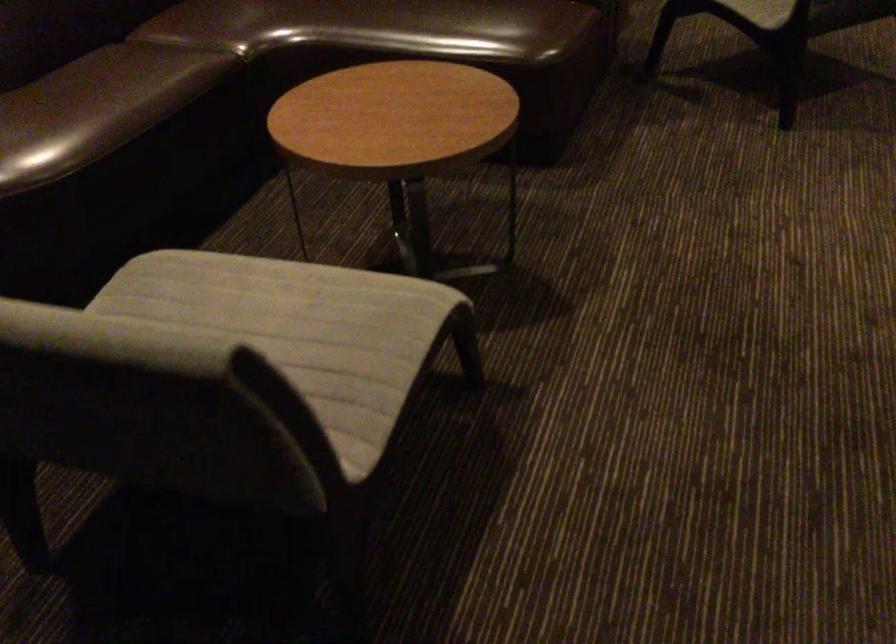
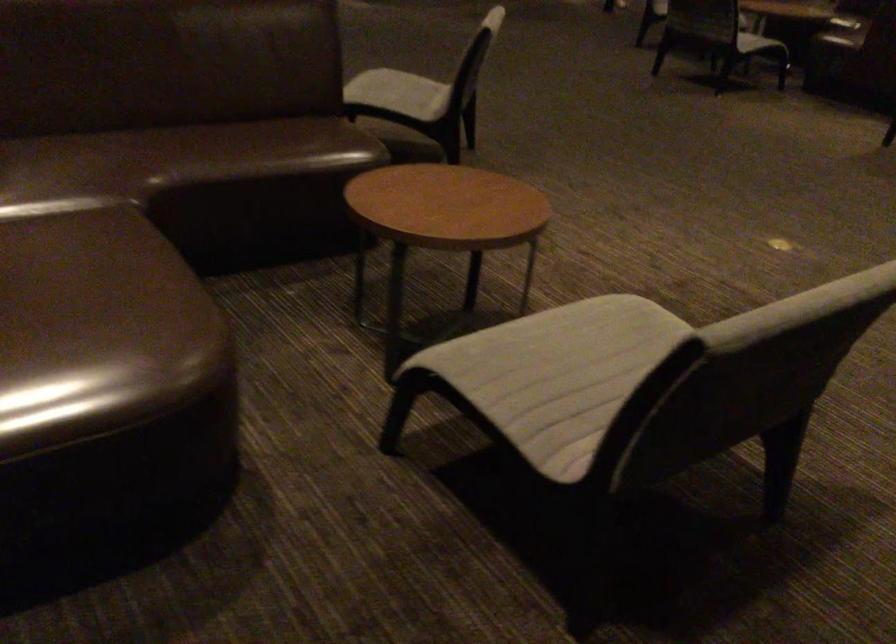
Locate, in the second image, the point that corresponds to point 191,323 in the first image.

(557, 374)